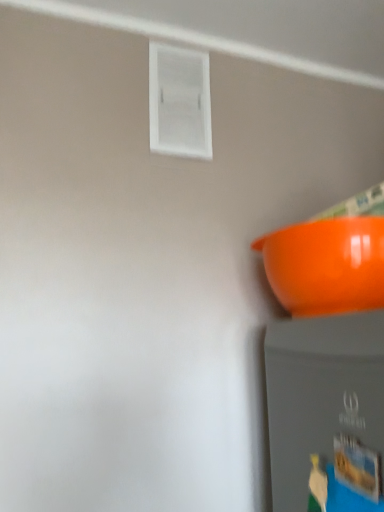
Question: From the image's perspective, is white plastic window at upper center located above glossy plastic bowl at right?

Choices:
 (A) no
 (B) yes

Answer: (B)

Question: Considering the relative sizes of white plastic window at upper center and glossy plastic bowl at right in the image provided, is white plastic window at upper center taller than glossy plastic bowl at right?

Choices:
 (A) yes
 (B) no

Answer: (A)

Question: Can you confirm if white plastic window at upper center is wider than glossy plastic bowl at right?

Choices:
 (A) yes
 (B) no

Answer: (B)

Question: Is white plastic window at upper center smaller than glossy plastic bowl at right?

Choices:
 (A) yes
 (B) no

Answer: (A)

Question: Is white plastic window at upper center facing towards glossy plastic bowl at right?

Choices:
 (A) yes
 (B) no

Answer: (B)

Question: Is white plastic window at upper center positioned with its back to glossy plastic bowl at right?

Choices:
 (A) no
 (B) yes

Answer: (A)

Question: From the image's perspective, is glossy plastic bowl at right over white plastic window at upper center?

Choices:
 (A) yes
 (B) no

Answer: (B)

Question: Is the surface of glossy plastic bowl at right in direct contact with white plastic window at upper center?

Choices:
 (A) yes
 (B) no

Answer: (B)

Question: Can you confirm if glossy plastic bowl at right is positioned to the right of white plastic window at upper center?

Choices:
 (A) no
 (B) yes

Answer: (B)

Question: From the image's perspective, does glossy plastic bowl at right appear lower than white plastic window at upper center?

Choices:
 (A) no
 (B) yes

Answer: (B)

Question: From a real-world perspective, is glossy plastic bowl at right located beneath white plastic window at upper center?

Choices:
 (A) no
 (B) yes

Answer: (B)

Question: Would you say glossy plastic bowl at right is outside white plastic window at upper center?

Choices:
 (A) no
 (B) yes

Answer: (B)

Question: In terms of width, does glossy plastic bowl at right look wider or thinner when compared to white plastic window at upper center?

Choices:
 (A) thin
 (B) wide

Answer: (B)